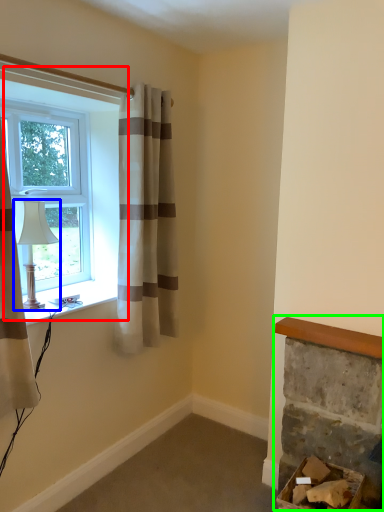
Question: Considering the real-world distances, which object is farthest from window (highlighted by a red box)? lamp (highlighted by a blue box) or fireplace (highlighted by a green box)?

Choices:
 (A) lamp
 (B) fireplace

Answer: (B)